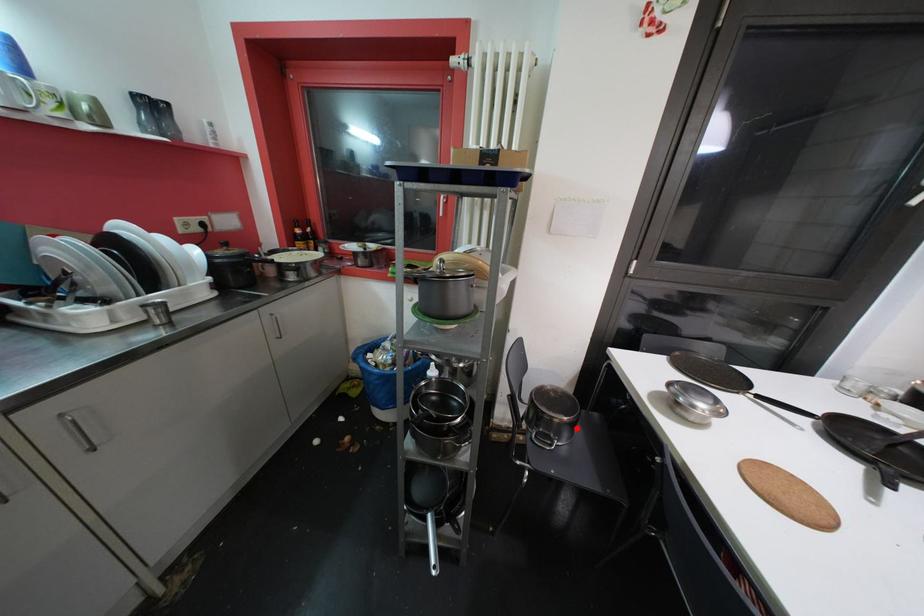
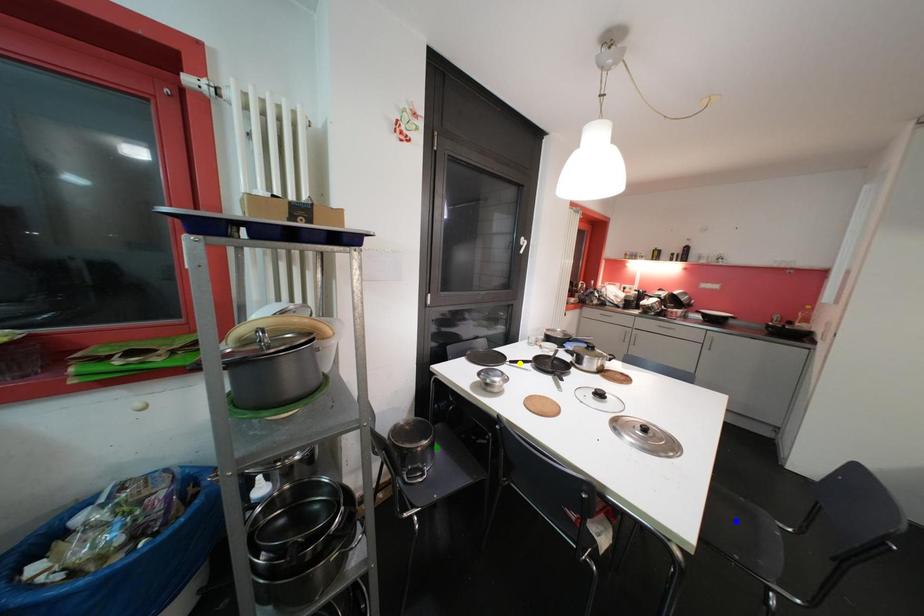
Question: I am providing you with two images of the same scene from different viewpoints. A red point is marked on the first image. You are given multiple points on the second image. Which point in image 2 represents the same 3d spot as the red point in image 1?

Choices:
 (A) blue point
 (B) green point
 (C) yellow point

Answer: (B)